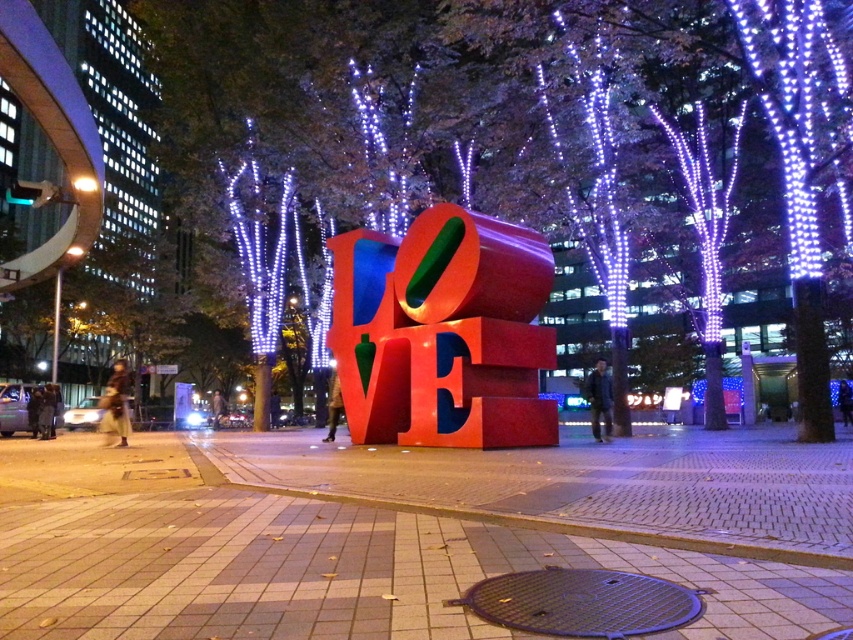
Does orange matte sculpture at center come in front of metallic brown manhole cover at lower center?

No, orange matte sculpture at center is further to the viewer.

Who is positioned more to the left, orange matte sculpture at center or metallic brown manhole cover at lower center?

orange matte sculpture at center is more to the left.

This screenshot has height=640, width=853. Describe the element at coordinates (444, 332) in the screenshot. I see `orange matte sculpture at center` at that location.

The height and width of the screenshot is (640, 853). I want to click on orange matte sculpture at center, so click(444, 332).

Is brick pavement at center above metallic brown manhole cover at lower center?

Incorrect, brick pavement at center is not positioned above metallic brown manhole cover at lower center.

Does brick pavement at center have a greater width compared to metallic brown manhole cover at lower center?

Indeed, brick pavement at center has a greater width compared to metallic brown manhole cover at lower center.

Identify the location of brick pavement at center. (337, 572).

Where is `brick pavement at center`? This screenshot has height=640, width=853. brick pavement at center is located at coordinates (337, 572).

Which of these two, brick pavement at center or orange matte sculpture at center, stands shorter?

brick pavement at center is shorter.

Does brick pavement at center appear on the right side of orange matte sculpture at center?

Incorrect, brick pavement at center is not on the right side of orange matte sculpture at center.

The width and height of the screenshot is (853, 640). In order to click on brick pavement at center in this screenshot , I will do `click(337, 572)`.